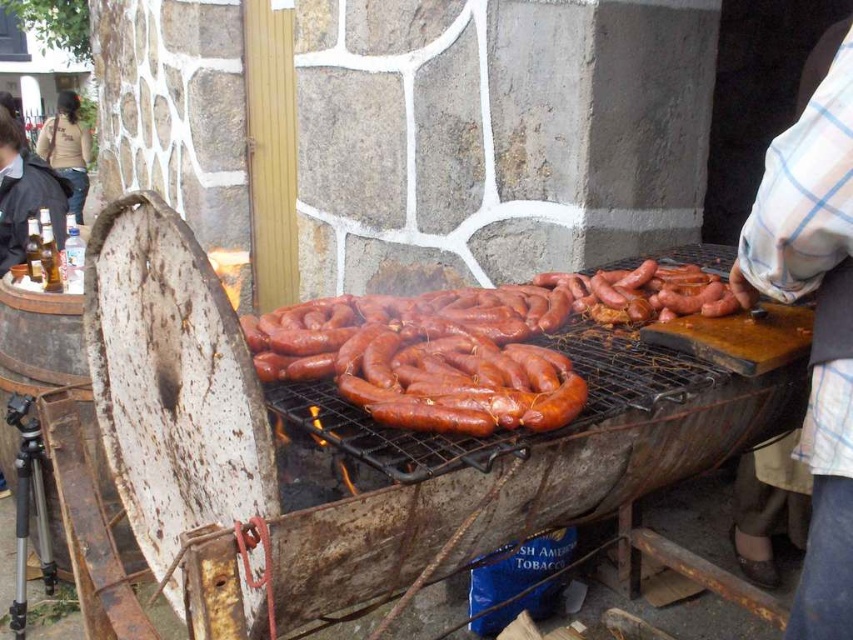
Question: Is white checkered shirt at upper right above dark brown shirt at upper left?

Choices:
 (A) no
 (B) yes

Answer: (A)

Question: Is white checkered shirt at upper right in front of dark brown shirt at upper left?

Choices:
 (A) no
 (B) yes

Answer: (B)

Question: Observing the image, what is the correct spatial positioning of white checkered shirt at upper right in reference to dark brown shirt at upper left?

Choices:
 (A) left
 (B) right

Answer: (B)

Question: Among these points, which one is farthest from the camera?

Choices:
 (A) (811, 417)
 (B) (61, 108)

Answer: (B)